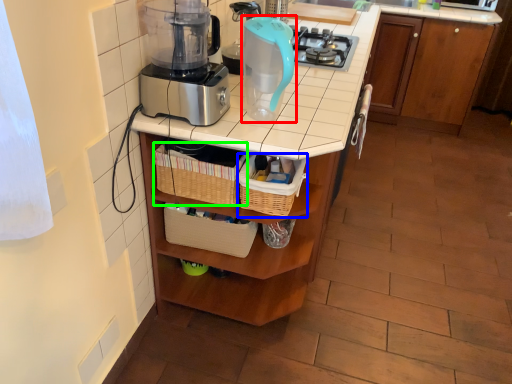
Question: Which object is the farthest from kitchen appliance (highlighted by a red box)? Choose among these: basket (highlighted by a blue box) or basket (highlighted by a green box).

Choices:
 (A) basket
 (B) basket

Answer: (B)